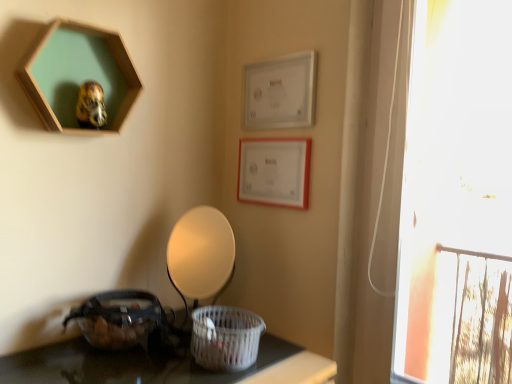
Question: Choose the correct answer: Is translucent plastic basket at lower left, acting as the second basket starting from the right, inside matte white picture frame at upper right, which is the 2th picture frame in right-to-left order, or outside it?

Choices:
 (A) inside
 (B) outside

Answer: (B)

Question: Visually, is translucent plastic basket at lower left, acting as the second basket starting from the right, positioned to the left or to the right of matte white picture frame at upper right, acting as the 2th picture frame starting from the left?

Choices:
 (A) right
 (B) left

Answer: (B)

Question: Estimate the real-world distances between objects in this image. Which object is closer to the matte white lampshade at center?

Choices:
 (A) translucent plastic basket at lower left, acting as the second basket starting from the right
 (B) matte white picture frame at upper right, which is the 2th picture frame in right-to-left order
 (C) white woven basket at lower center, which is counted as the second basket, starting from the left
 (D) transparent glass window at right
 (E) wooden hexagon at upper left, which is counted as the 3th picture frame, starting from the right

Answer: (C)

Question: Which object is the closest to the white matte picture frame at upper center, which appears as the 1th picture frame when viewed from the right?

Choices:
 (A) white woven basket at lower center, which is the first basket in right-to-left order
 (B) transparent glass window at right
 (C) wooden hexagon at upper left, the 1th picture frame from the left
 (D) matte white picture frame at upper right, acting as the 2th picture frame starting from the left
 (E) matte white lampshade at center

Answer: (D)